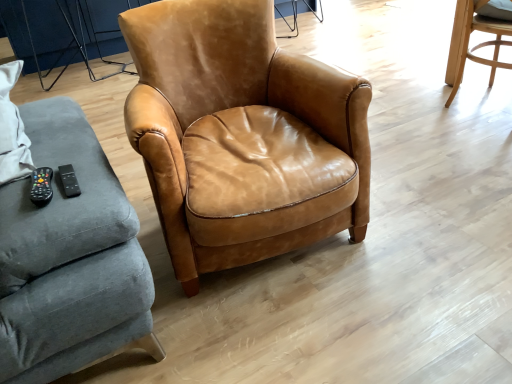
Measure the distance between point (x=321, y=155) and camera.

Point (x=321, y=155) is 1.31 meters away from camera.

What do you see at coordinates (238, 132) in the screenshot?
I see `cognac leather armchair at center, the 2th chair when ordered from right to left` at bounding box center [238, 132].

The width and height of the screenshot is (512, 384). What are the coordinates of `cognac leather armchair at center, the 2th chair when ordered from right to left` in the screenshot? It's located at (238, 132).

What do you see at coordinates (481, 43) in the screenshot? This screenshot has height=384, width=512. I see `light brown leather chair at upper right, which appears as the 1th chair when viewed from the right` at bounding box center [481, 43].

At what (x,y) coordinates should I click in order to perform the action: click on light brown leather chair at upper right, the 2th chair when ordered from left to right. Please return your answer as a coordinate pair (x, y). Image resolution: width=512 pixels, height=384 pixels. Looking at the image, I should click on (481, 43).

What are the coordinates of `cognac leather armchair at center, acting as the first chair starting from the left` in the screenshot? It's located at (238, 132).

Based on their positions, is cognac leather armchair at center, the 2th chair when ordered from right to left, located to the left or right of light brown leather chair at upper right, which appears as the 1th chair when viewed from the right?

From the image, it's evident that cognac leather armchair at center, the 2th chair when ordered from right to left, is to the left of light brown leather chair at upper right, which appears as the 1th chair when viewed from the right.

Does cognac leather armchair at center, the 2th chair when ordered from right to left, lie behind light brown leather chair at upper right, the 2th chair when ordered from left to right?

No, cognac leather armchair at center, the 2th chair when ordered from right to left, is closer to the camera.

Is point (234, 82) closer to camera compared to point (484, 3)?

Yes.

From the image's perspective, between cognac leather armchair at center, the 2th chair when ordered from right to left, and light brown leather chair at upper right, the 2th chair when ordered from left to right, who is located below?

cognac leather armchair at center, the 2th chair when ordered from right to left, is shown below in the image.

Consider the image. From a real-world perspective, which is physically above, cognac leather armchair at center, acting as the first chair starting from the left, or light brown leather chair at upper right, the 2th chair when ordered from left to right?

cognac leather armchair at center, acting as the first chair starting from the left, from a real-world perspective.

Based on the photo, is cognac leather armchair at center, acting as the first chair starting from the left, wider or thinner than light brown leather chair at upper right, the 2th chair when ordered from left to right?

In the image, cognac leather armchair at center, acting as the first chair starting from the left, appears to be wider than light brown leather chair at upper right, the 2th chair when ordered from left to right.

From their relative heights in the image, would you say cognac leather armchair at center, acting as the first chair starting from the left, is taller or shorter than light brown leather chair at upper right, the 2th chair when ordered from left to right?

Considering their sizes, cognac leather armchair at center, acting as the first chair starting from the left, has more height than light brown leather chair at upper right, the 2th chair when ordered from left to right.

Is cognac leather armchair at center, acting as the first chair starting from the left, bigger than light brown leather chair at upper right, which appears as the 1th chair when viewed from the right?

Yes, cognac leather armchair at center, acting as the first chair starting from the left, is bigger than light brown leather chair at upper right, which appears as the 1th chair when viewed from the right.

Is cognac leather armchair at center, acting as the first chair starting from the left, inside the boundaries of light brown leather chair at upper right, the 2th chair when ordered from left to right, or outside?

The correct answer is: outside.

Are cognac leather armchair at center, the 2th chair when ordered from right to left, and light brown leather chair at upper right, the 2th chair when ordered from left to right, beside each other?

No, cognac leather armchair at center, the 2th chair when ordered from right to left, is not beside light brown leather chair at upper right, the 2th chair when ordered from left to right.

Consider the image. Is cognac leather armchair at center, acting as the first chair starting from the left, oriented away from light brown leather chair at upper right, the 2th chair when ordered from left to right?

No.

How much distance is there between cognac leather armchair at center, the 2th chair when ordered from right to left, and light brown leather chair at upper right, the 2th chair when ordered from left to right?

A distance of 1.49 meters exists between cognac leather armchair at center, the 2th chair when ordered from right to left, and light brown leather chair at upper right, the 2th chair when ordered from left to right.

In the image, there is a light brown leather chair at upper right, which appears as the 1th chair when viewed from the right. Identify the location of chair below it (from the image's perspective). (238, 132).

Which object is positioned more to the left, light brown leather chair at upper right, the 2th chair when ordered from left to right, or cognac leather armchair at center, the 2th chair when ordered from right to left?

cognac leather armchair at center, the 2th chair when ordered from right to left, is more to the left.

Which object is closer to the camera, light brown leather chair at upper right, the 2th chair when ordered from left to right, or cognac leather armchair at center, acting as the first chair starting from the left?

cognac leather armchair at center, acting as the first chair starting from the left, is more forward.

Which is less distant, [470,52] or [239,132]?

Positioned in front is point [239,132].

From the image's perspective, relative to cognac leather armchair at center, acting as the first chair starting from the left, is light brown leather chair at upper right, the 2th chair when ordered from left to right, above or below?

Clearly, from the image's perspective, light brown leather chair at upper right, the 2th chair when ordered from left to right, is above cognac leather armchair at center, acting as the first chair starting from the left.

From a real-world perspective, which object rests below the other?

From a 3D spatial view, light brown leather chair at upper right, the 2th chair when ordered from left to right, is below.

Considering the sizes of light brown leather chair at upper right, which appears as the 1th chair when viewed from the right, and cognac leather armchair at center, the 2th chair when ordered from right to left, in the image, is light brown leather chair at upper right, which appears as the 1th chair when viewed from the right, wider or thinner than cognac leather armchair at center, the 2th chair when ordered from right to left,?

In the image, light brown leather chair at upper right, which appears as the 1th chair when viewed from the right, appears to be more narrow than cognac leather armchair at center, the 2th chair when ordered from right to left.

From the picture: Does light brown leather chair at upper right, which appears as the 1th chair when viewed from the right, have a lesser height compared to cognac leather armchair at center, the 2th chair when ordered from right to left?

Correct, light brown leather chair at upper right, which appears as the 1th chair when viewed from the right, is not as tall as cognac leather armchair at center, the 2th chair when ordered from right to left.

Who is smaller, light brown leather chair at upper right, which appears as the 1th chair when viewed from the right, or cognac leather armchair at center, the 2th chair when ordered from right to left?

Smaller between the two is light brown leather chair at upper right, which appears as the 1th chair when viewed from the right.

Is light brown leather chair at upper right, which appears as the 1th chair when viewed from the right, inside the boundaries of cognac leather armchair at center, the 2th chair when ordered from right to left, or outside?

light brown leather chair at upper right, which appears as the 1th chair when viewed from the right, lies outside cognac leather armchair at center, the 2th chair when ordered from right to left.

Is light brown leather chair at upper right, which appears as the 1th chair when viewed from the right, next to cognac leather armchair at center, the 2th chair when ordered from right to left, and touching it?

No, light brown leather chair at upper right, which appears as the 1th chair when viewed from the right, is not in contact with cognac leather armchair at center, the 2th chair when ordered from right to left.

Is light brown leather chair at upper right, which appears as the 1th chair when viewed from the right, turned away from cognac leather armchair at center, acting as the first chair starting from the left?

Yes.

How many degrees apart are the facing directions of light brown leather chair at upper right, the 2th chair when ordered from left to right, and cognac leather armchair at center, the 2th chair when ordered from right to left?

104 degrees.

Where is `chair behind the cognac leather armchair at center, the 2th chair when ordered from right to left`? This screenshot has height=384, width=512. chair behind the cognac leather armchair at center, the 2th chair when ordered from right to left is located at coordinates coord(481,43).

At what (x,y) coordinates should I click in order to perform the action: click on chair above the cognac leather armchair at center, acting as the first chair starting from the left (from the image's perspective). Please return your answer as a coordinate pair (x, y). The height and width of the screenshot is (384, 512). Looking at the image, I should click on (481, 43).

At what (x,y) coordinates should I click in order to perform the action: click on chair lying on the left of light brown leather chair at upper right, the 2th chair when ordered from left to right. Please return your answer as a coordinate pair (x, y). Looking at the image, I should click on (238, 132).